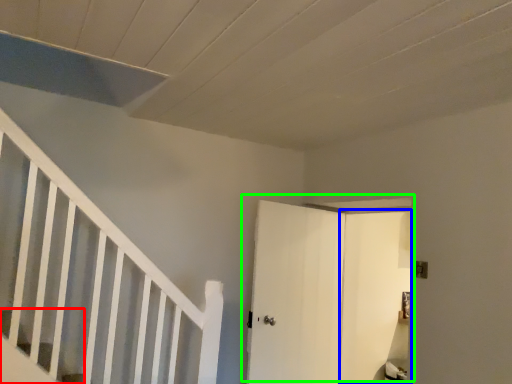
Question: Which object is positioned closest to stairs (highlighted by a red box)? Select from door (highlighted by a blue box) and door (highlighted by a green box).

Choices:
 (A) door
 (B) door

Answer: (B)